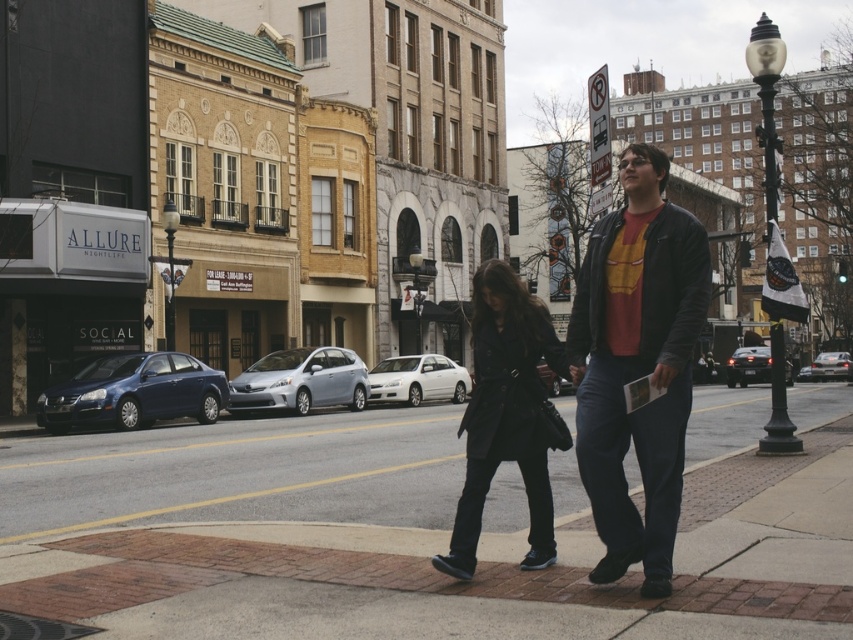
You are standing on the sidewalk in the scene and want to cross the street to reach a coffee shop located 100 feet ahead. The satin silver hatchback at center is blocking your path. Can you walk around it without crossing into the street?

The satin silver hatchback at center is 78.68 feet from viewer, which is closer than the 100 feet distance to the coffee shop. You can walk around it by moving to the side along the sidewalk without entering the street.

You are a pedestrian on the sidewalk and want to cross the street to reach the park on the other side. There are two cars in the middle of the road, a satin silver hatchback at center and a silver metallic sedan at center. Which car should you cross in front of to get to the park quickly?

You should cross in front of the satin silver hatchback at center because it is positioned to the left of the silver metallic sedan at center, so it is closer to your starting point on the sidewalk.

You are a pedestrian standing on the sidewalk and want to cross the street to reach the park on the other side. The two sedans are parked parallel to each other along the street. Given that the minimum safe distance required to safely cross between two parked cars is 30 feet, can you safely cross between the shiny black sedan at center and the silver metallic sedan at center?

The shiny black sedan at center and silver metallic sedan at center are 35.10 feet apart from each other. Since the required minimum safe distance is 30 feet, the distance between them is sufficient. Therefore, you can safely cross between the shiny black sedan at center and the silver metallic sedan at center.